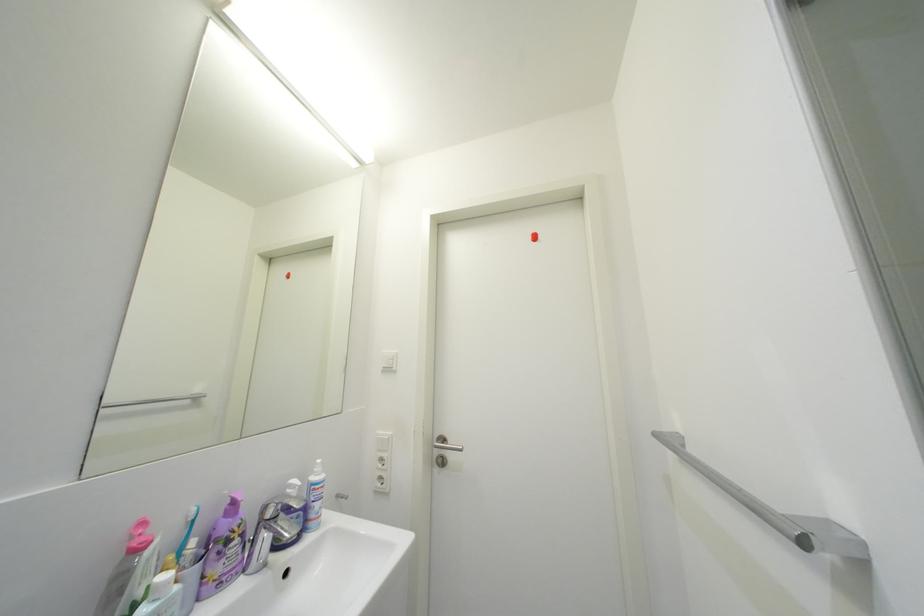
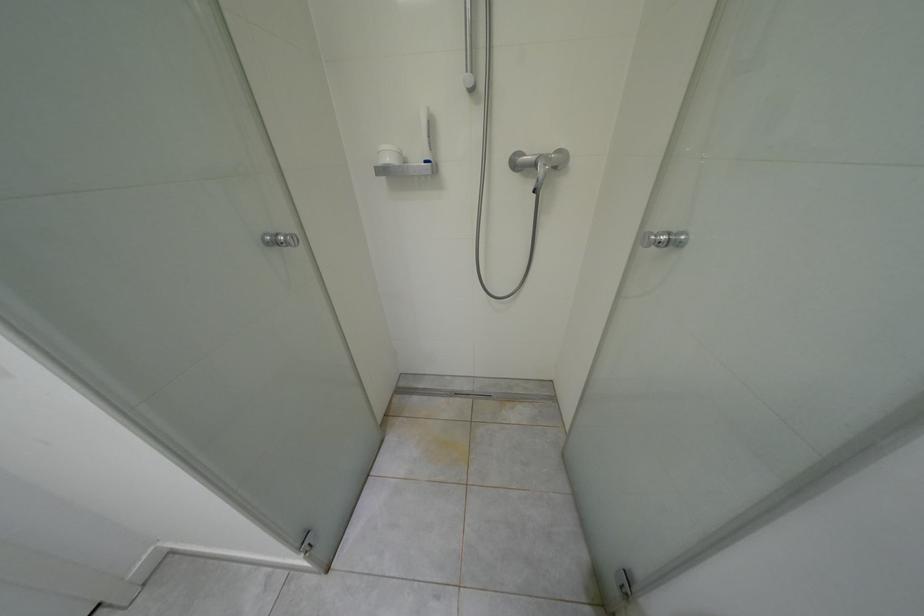
Based on the continuous images, in which direction is the camera rotating?

The rotation direction of the camera is right-down.